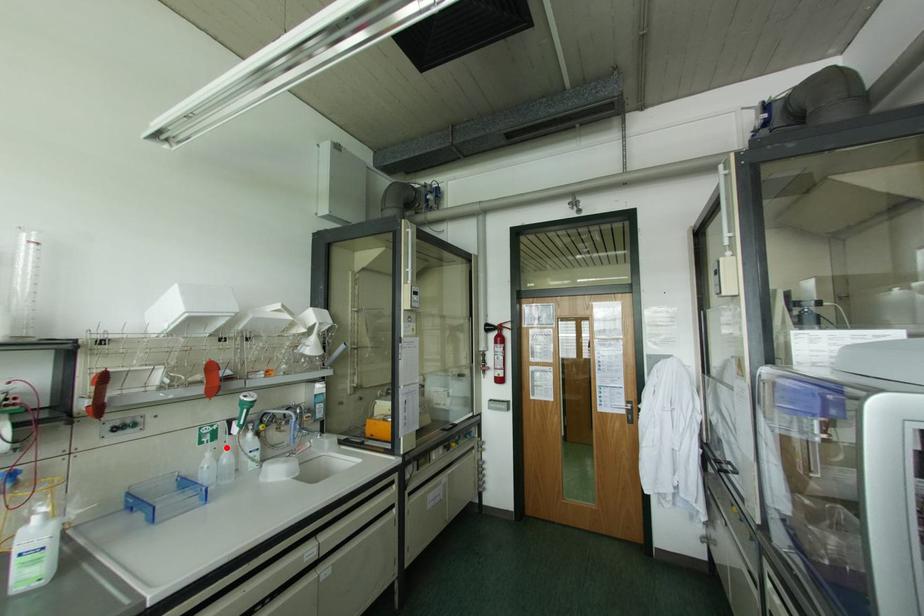
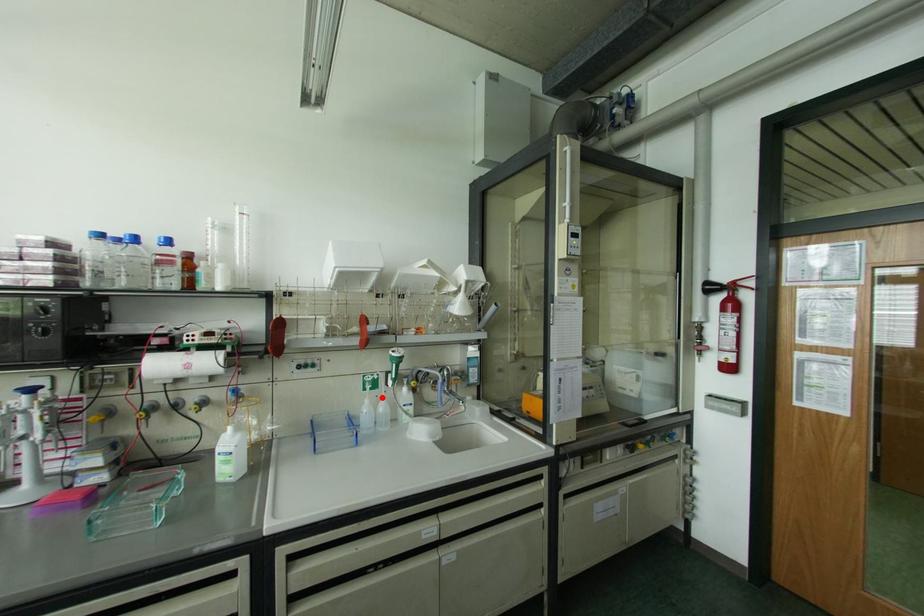
I am providing you with two images of the same scene from different viewpoints. A red point is marked on the first image and another point is marked on the second image. Do the highlighted points in image1 and image2 indicate the same real-world spot?

Yes